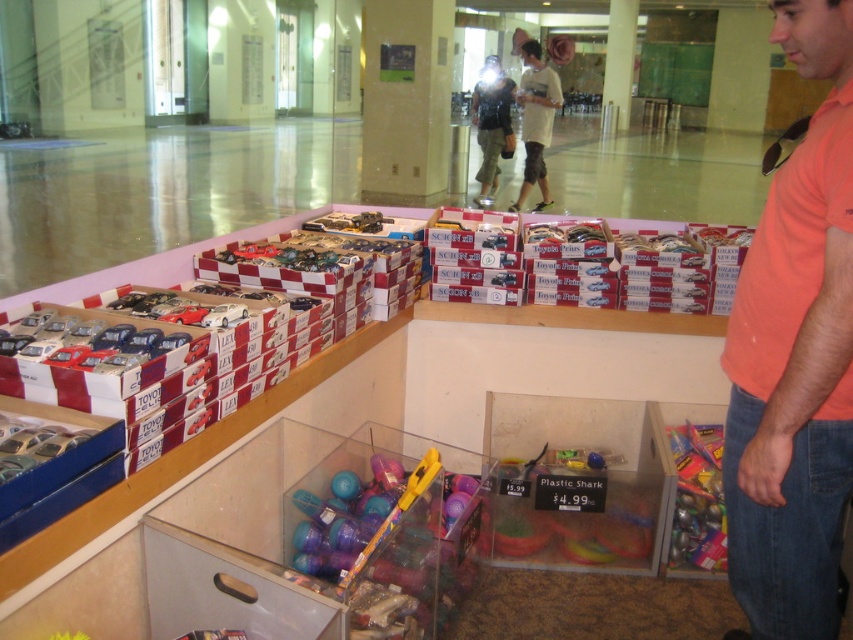
Consider the image. Which is below, orange cotton shirt at right or white cotton shirt at upper center?

Positioned lower is orange cotton shirt at right.

Does orange cotton shirt at right appear over white cotton shirt at upper center?

No.

The width and height of the screenshot is (853, 640). Find the location of `orange cotton shirt at right`. orange cotton shirt at right is located at coordinates (795, 356).

Is orange cotton shirt at right above translucent plastic toy at lower right?

Yes, orange cotton shirt at right is above translucent plastic toy at lower right.

Does orange cotton shirt at right have a greater height compared to translucent plastic toy at lower right?

Yes.

Identify the location of orange cotton shirt at right. (795, 356).

Does white cotton shirt at upper center appear over matte black backpack at center?

No.

Does white cotton shirt at upper center have a smaller size compared to matte black backpack at center?

No.

Is point (537, 68) closer to viewer compared to point (485, 93)?

Yes, point (537, 68) is closer to viewer.

I want to click on white cotton shirt at upper center, so click(535, 120).